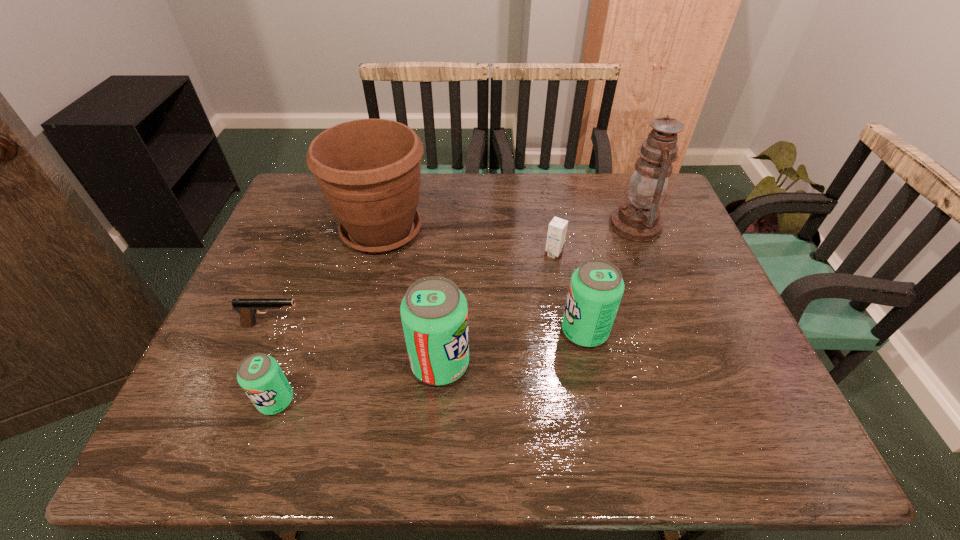
You are a GUI agent. You are given a task and a screenshot of the screen. Output one action in this format:
    pyautogui.click(x=<x>, y=<y>)
    Task: Click on the vacant region that satisfies the following two spatial constraints: 1. on the front side of the rightmost object; 2. on the front-facing side of the second pop soda from left to right
    The image size is (960, 540).
    Given the screenshot: What is the action you would take?
    pyautogui.click(x=688, y=363)

You are a GUI agent. You are given a task and a screenshot of the screen. Output one action in this format:
    pyautogui.click(x=<x>, y=<y>)
    Task: Click on the blank area in the image that satisfies the following two spatial constraints: 1. on the back side of the oil lamp; 2. on the right side of the second tallest object
    This screenshot has height=540, width=960.
    Given the screenshot: What is the action you would take?
    pyautogui.click(x=383, y=225)